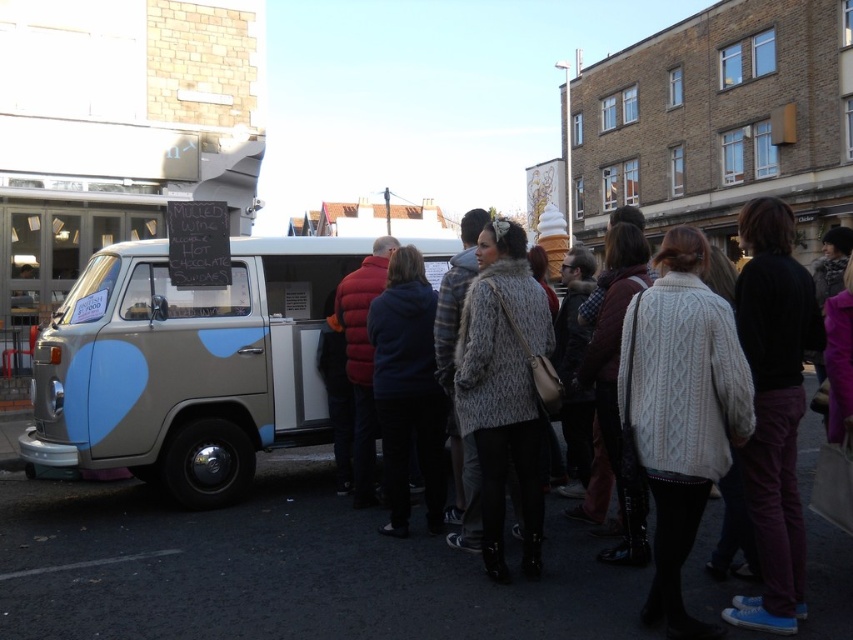
Does knitted sweater at center have a greater width compared to black asphalt at lower left?

No, knitted sweater at center is not wider than black asphalt at lower left.

Is knitted sweater at center taller than black asphalt at lower left?

No, knitted sweater at center is not taller than black asphalt at lower left.

Find the location of `knitted sweater at center`. knitted sweater at center is located at coordinates (474, 586).

How distant is matte beige van at center from knitted sweater at center?

matte beige van at center is 11.08 feet away from knitted sweater at center.

Which is in front, point (68, 348) or point (439, 625)?

Point (439, 625) is more forward.

Is point (326, 257) behind point (482, 596)?

Yes, point (326, 257) is behind point (482, 596).

Where is `matte beige van at center`? The width and height of the screenshot is (853, 640). matte beige van at center is located at coordinates (186, 365).

Can you confirm if matte beige van at center is positioned above black asphalt at lower left?

Correct, matte beige van at center is located above black asphalt at lower left.

Is point (206, 326) positioned before point (134, 554)?

That is False.

Which is in front, point (119, 348) or point (26, 572)?

Positioned in front is point (26, 572).

You are a GUI agent. You are given a task and a screenshot of the screen. Output one action in this format:
    pyautogui.click(x=<x>, y=<y>)
    Task: Click on the matte beige van at center
    
    Given the screenshot: What is the action you would take?
    pyautogui.click(x=186, y=365)